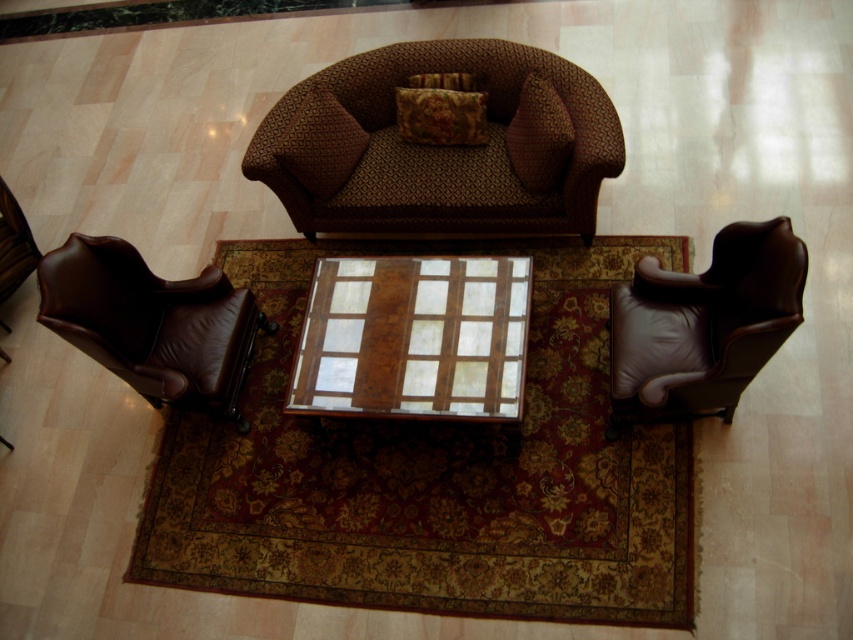
Can you confirm if brown textured couch at center is positioned to the left of floral fabric pillow at center?

Yes, brown textured couch at center is to the left of floral fabric pillow at center.

How far apart are brown textured couch at center and floral fabric pillow at center?

A distance of 9.30 inches exists between brown textured couch at center and floral fabric pillow at center.

Which is in front, point (381, 230) or point (399, 88)?

Positioned in front is point (399, 88).

In order to click on brown textured couch at center in this screenshot , I will do `click(440, 145)`.

Is brown textured couch at center smaller than velvet cushion at center?

Incorrect, brown textured couch at center is not smaller in size than velvet cushion at center.

Who is positioned more to the right, brown textured couch at center or velvet cushion at center?

Positioned to the right is velvet cushion at center.

Is point (579, 96) positioned before point (532, 179)?

Yes, it is.

You are a GUI agent. You are given a task and a screenshot of the screen. Output one action in this format:
    pyautogui.click(x=<x>, y=<y>)
    Task: Click on the brown textured couch at center
    
    Given the screenshot: What is the action you would take?
    pyautogui.click(x=440, y=145)

Is point (795, 236) less distant than point (509, 131)?

Yes, it is in front of point (509, 131).

Between point (752, 244) and point (532, 150), which one is positioned behind?

Positioned behind is point (532, 150).

Identify the location of leather wingback chair at right. This screenshot has height=640, width=853. (704, 324).